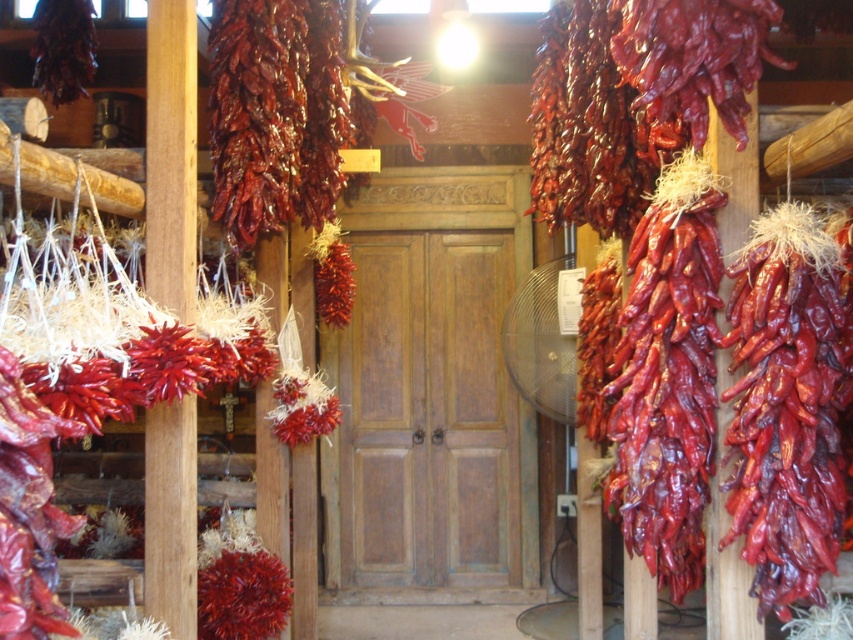
Question: Among these points, which one is nearest to the camera?

Choices:
 (A) (276, 131)
 (B) (157, 516)

Answer: (B)

Question: Does dried red pepper at right appear on the right side of dried red pepper at center?

Choices:
 (A) no
 (B) yes

Answer: (B)

Question: Can you confirm if dried red pepper at right is positioned below wooden post at left?

Choices:
 (A) yes
 (B) no

Answer: (A)

Question: Can you confirm if dried red pepper at center is positioned below wooden post at left?

Choices:
 (A) yes
 (B) no

Answer: (B)

Question: Estimate the real-world distances between objects in this image. Which object is farther from the wooden post at left?

Choices:
 (A) dried red pepper at center
 (B) dried red pepper at right

Answer: (B)

Question: Based on their relative distances, which object is farther from the wooden post at left?

Choices:
 (A) dried red pepper at center
 (B) dried red pepper at right

Answer: (B)